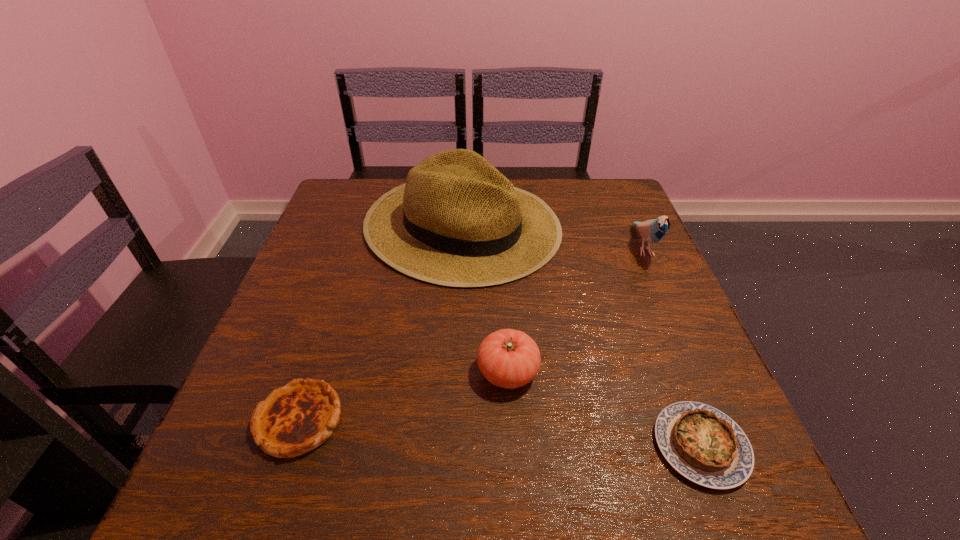
You are a GUI agent. You are given a task and a screenshot of the screen. Output one action in this format:
    pyautogui.click(x=<x>, y=<y>)
    Task: Click on the tallest object
    This screenshot has width=960, height=540.
    Given the screenshot: What is the action you would take?
    pyautogui.click(x=457, y=221)

Find the location of `bird`. bird is located at coordinates (652, 231).

Identify the location of the third tallest object. (508, 358).

What are the coordinates of `the left quiche` in the screenshot? It's located at (294, 419).

At what (x,y) coordinates should I click in order to perform the action: click on the right quiche. Please return your answer as a coordinate pair (x, y). This screenshot has height=540, width=960. Looking at the image, I should click on (703, 444).

Find the location of a particular element. vacant space located on the left of the sunhat is located at coordinates (336, 226).

Find the location of a particular element. The width and height of the screenshot is (960, 540). free location located 0.050m at the face of the bird is located at coordinates (661, 287).

You are a GUI agent. You are given a task and a screenshot of the screen. Output one action in this format:
    pyautogui.click(x=<x>, y=<y>)
    Task: Click on the blank space located 0.370m on the back of the third tallest object
    The image size is (960, 540).
    Given the screenshot: What is the action you would take?
    pyautogui.click(x=500, y=231)

Locate an element on the screen. The image size is (960, 540). vacant region located 0.330m on the right of the left quiche is located at coordinates (545, 421).

I want to click on vacant space situated on the left of the right quiche, so click(x=454, y=446).